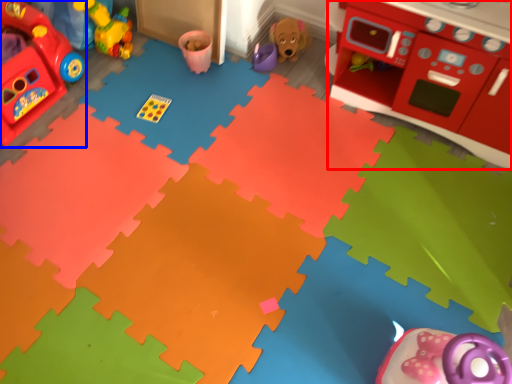
Question: Which object appears closest to the camera in this image, appliance (highlighted by a red box) or toy (highlighted by a blue box)?

Choices:
 (A) appliance
 (B) toy

Answer: (A)